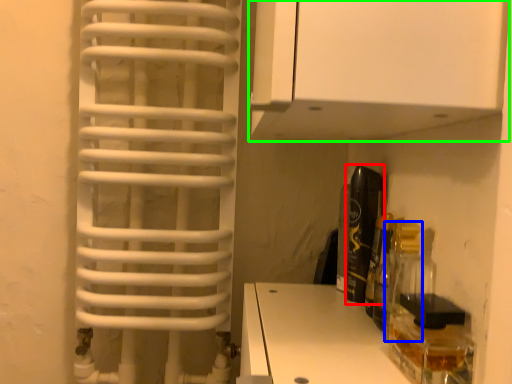
Question: Estimate the real-world distances between objects in this image. Which object is farther from bottle (highlighted by a red box), bottle (highlighted by a blue box) or cabinetry (highlighted by a green box)?

Choices:
 (A) bottle
 (B) cabinetry

Answer: (B)